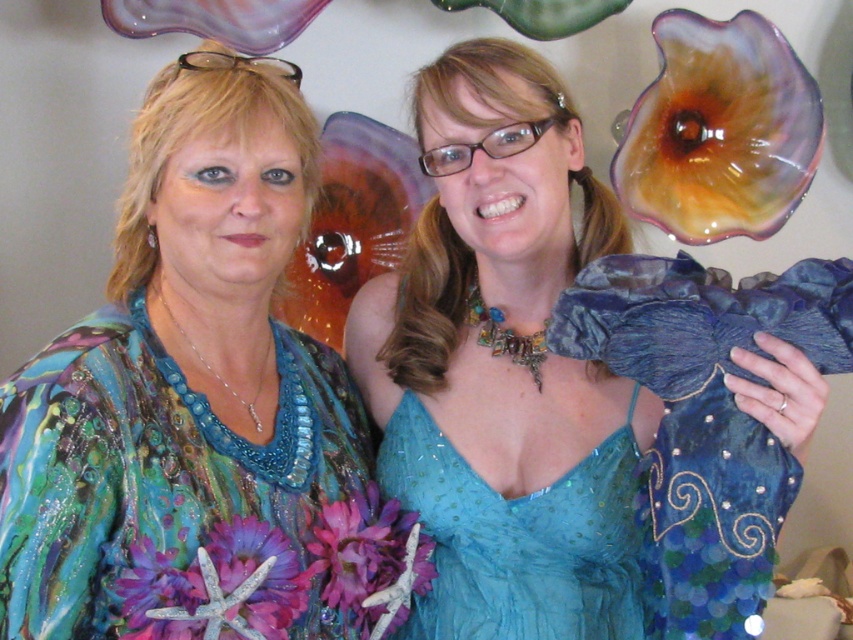
You are a photographer setting up for a portrait shoot. You notice two dresses in the scene, the shiny blue dress at center and the blue sequined dress at center. Which dress is closer to the camera?

The shiny blue dress at center is closer to the camera because it is in front of the blue sequined dress at center.

In the scene shown: You are a photographer setting up a shoot in this scene. You need to place a small prop exactly at the coordinates mentioned in the Objects Description. Where should you place the prop in relation to the shiny blue dress at center?

The prop should be placed at the coordinates point (198, 406) where the shiny blue dress at center is located.